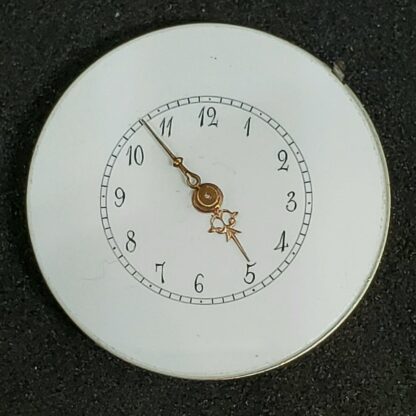
Where is `clock face`? clock face is located at coordinates (208, 207).